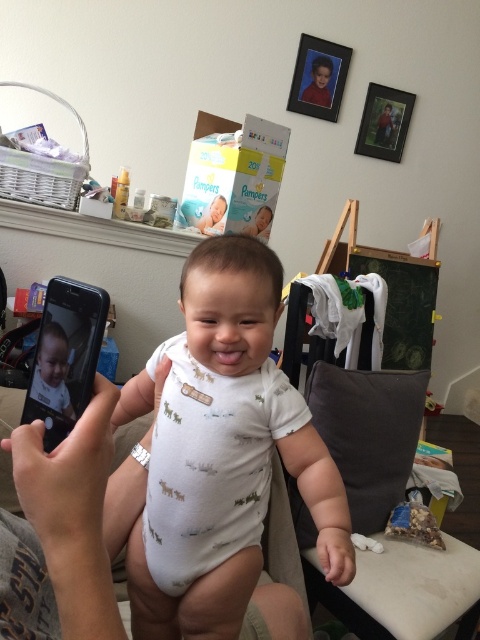
Question: Is white soft onesie at center to the right of white cotton onesie at center from the viewer's perspective?

Choices:
 (A) no
 (B) yes

Answer: (B)

Question: Which of the following is the farthest from the observer?

Choices:
 (A) (226, 451)
 (B) (342, 426)
 (C) (79, 368)
 (D) (282, 376)

Answer: (B)

Question: Estimate the real-world distances between objects in this image. Which object is farther from the white cotton onesie at center?

Choices:
 (A) gray fabric armchair at lower right
 (B) black matte smartphone at left

Answer: (A)

Question: Does white cotton onesie at center have a smaller size compared to black matte smartphone at left?

Choices:
 (A) no
 (B) yes

Answer: (A)

Question: Does white soft onesie at center appear under gray fabric armchair at lower right?

Choices:
 (A) no
 (B) yes

Answer: (A)

Question: Among these points, which one is nearest to the camera?

Choices:
 (A) (336, 413)
 (B) (164, 476)

Answer: (B)